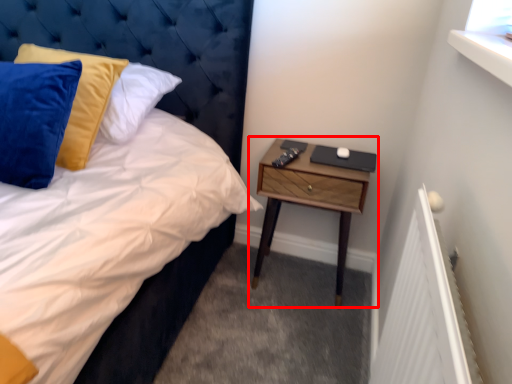
Question: From the image's perspective, what is the correct spatial positioning of nightstand (annotated by the red box) in reference to headboard?

Choices:
 (A) above
 (B) below

Answer: (B)